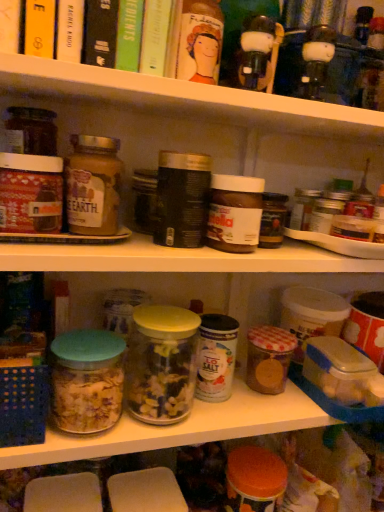
The width and height of the screenshot is (384, 512). Describe the element at coordinates (93, 185) in the screenshot. I see `matte glass jar at left, which ranks as the first cereal in left-to-right order` at that location.

What do you see at coordinates (100, 32) in the screenshot?
I see `hardcover book at upper left, acting as the 3th book starting from the right` at bounding box center [100, 32].

How much space does translucent glass jar at center, positioned as the 1th glass jar in right-to-left order, occupy horizontally?

translucent glass jar at center, positioned as the 1th glass jar in right-to-left order, is 10.41 centimeters in width.

The height and width of the screenshot is (512, 384). Describe the element at coordinates (269, 358) in the screenshot. I see `translucent glass jar of cereal at center, which appears as the second cereal when viewed from the front` at that location.

The height and width of the screenshot is (512, 384). Find the location of `hardcover book at upper left, the 1th book when ordered from left to right`. hardcover book at upper left, the 1th book when ordered from left to right is located at coordinates (70, 30).

Locate an element on the screen. The height and width of the screenshot is (512, 384). matte plastic jars at upper center, placed as the first shelf when sorted from top to bottom is located at coordinates (185, 97).

Could hardcover book at upper left, the fourth book from the right, be considered to be inside clear glass jars at center, arranged as the second shelf when viewed from the top?

No, hardcover book at upper left, the fourth book from the right, is not inside clear glass jars at center, arranged as the second shelf when viewed from the top.

Considering the positions of points (182, 423) and (63, 26), is point (182, 423) farther from camera compared to point (63, 26)?

Yes, point (182, 423) is behind point (63, 26).

Can you confirm if clear glass jars at center, placed as the first shelf when sorted from bottom to top, is thinner than hardcover book at upper left, the fourth book from the right?

No, clear glass jars at center, placed as the first shelf when sorted from bottom to top, is not thinner than hardcover book at upper left, the fourth book from the right.

Does clear glass jars at center, arranged as the second shelf when viewed from the top, touch hardcover book at upper left, the fourth book from the right?

No.

How different are the orientations of matte plastic jars at upper center, the 2th shelf ordered from the bottom, and green matte book at upper center, which appears as the third book when viewed from the left, in degrees?

A: 2.67 degrees separate the facing orientations of matte plastic jars at upper center, the 2th shelf ordered from the bottom, and green matte book at upper center, which appears as the third book when viewed from the left.

Between matte plastic jars at upper center, the 2th shelf ordered from the bottom, and green matte book at upper center, the second book when ordered from right to left, which one has less height?

With less height is matte plastic jars at upper center, the 2th shelf ordered from the bottom.

Starting from the matte plastic jars at upper center, placed as the first shelf when sorted from top to bottom, which book is the 3rd one behind? Please provide its 2D coordinates.

[(129, 35)]

Is green matte book at upper center, which is the 1th book from right to left, closer to camera compared to hardcover book at upper left, the fourth book from the right?

No, green matte book at upper center, which is the 1th book from right to left, is further to the viewer.

Is point (159, 50) behind point (79, 37)?

Yes.

From a real-world perspective, is green matte book at upper center, the second book when ordered from right to left, beneath green matte book at upper center, the 4th book viewed from the left?

Yes, from a real-world perspective, green matte book at upper center, the second book when ordered from right to left, is under green matte book at upper center, the 4th book viewed from the left.

Considering the sizes of objects green matte book at upper center, which appears as the third book when viewed from the left, and green matte book at upper center, the 4th book viewed from the left, in the image provided, who is smaller, green matte book at upper center, which appears as the third book when viewed from the left, or green matte book at upper center, the 4th book viewed from the left,?

Smaller between the two is green matte book at upper center, which appears as the third book when viewed from the left.

Consider the image. Is green matte book at upper center, the second book when ordered from right to left, aimed at green matte book at upper center, the 4th book viewed from the left?

No.

Considering the sizes of objects translucent glass jar filled with cereal at center, the first glass jar in the left-to-right sequence, and translucent glass jar of cereal at center, acting as the 1th cereal starting from the back, in the image provided, who is bigger, translucent glass jar filled with cereal at center, the first glass jar in the left-to-right sequence, or translucent glass jar of cereal at center, acting as the 1th cereal starting from the back,?

translucent glass jar filled with cereal at center, the first glass jar in the left-to-right sequence.

How far apart are translucent glass jar filled with cereal at center, the first glass jar in the left-to-right sequence, and translucent glass jar of cereal at center, acting as the 1th cereal starting from the back?

translucent glass jar filled with cereal at center, the first glass jar in the left-to-right sequence, and translucent glass jar of cereal at center, acting as the 1th cereal starting from the back, are 27.56 centimeters apart from each other.

Considering the positions of objects translucent glass jar filled with cereal at center, the 2th glass jar in the right-to-left sequence, and translucent glass jar of cereal at center, which ranks as the 1th cereal in bottom-to-top order, in the image provided, who is more to the left, translucent glass jar filled with cereal at center, the 2th glass jar in the right-to-left sequence, or translucent glass jar of cereal at center, which ranks as the 1th cereal in bottom-to-top order,?

translucent glass jar filled with cereal at center, the 2th glass jar in the right-to-left sequence, is more to the left.

Considering the relative positions of translucent glass jar filled with cereal at center, the first glass jar in the left-to-right sequence, and translucent glass jar of cereal at center, which appears as the second cereal when viewed from the front, in the image provided, is translucent glass jar filled with cereal at center, the first glass jar in the left-to-right sequence, behind translucent glass jar of cereal at center, which appears as the second cereal when viewed from the front,?

No, the depth of translucent glass jar filled with cereal at center, the first glass jar in the left-to-right sequence, is less than that of translucent glass jar of cereal at center, which appears as the second cereal when viewed from the front.

From a real-world perspective, which is physically above, translucent glass jar filled with cereal at center, the first glass jar in the left-to-right sequence, or green matte book at upper center, the second book when ordered from right to left?

From a 3D spatial view, green matte book at upper center, the second book when ordered from right to left, is above.

Would you say translucent glass jar filled with cereal at center, the 2th glass jar in the right-to-left sequence, contains green matte book at upper center, the second book when ordered from right to left?

No, green matte book at upper center, the second book when ordered from right to left, is located outside of translucent glass jar filled with cereal at center, the 2th glass jar in the right-to-left sequence.

In terms of width, does translucent glass jar filled with cereal at center, the first glass jar in the left-to-right sequence, look wider or thinner when compared to green matte book at upper center, which appears as the third book when viewed from the left?

Result: Clearly, translucent glass jar filled with cereal at center, the first glass jar in the left-to-right sequence, has less width compared to green matte book at upper center, which appears as the third book when viewed from the left.

Between point (63, 367) and point (136, 23), which one is positioned behind?

The point (63, 367) is behind.

Can you confirm if translucent glass jar at center, positioned as the 1th glass jar in right-to-left order, is shorter than hardcover book at upper left, the fourth book from the right?

Indeed, translucent glass jar at center, positioned as the 1th glass jar in right-to-left order, has a lesser height compared to hardcover book at upper left, the fourth book from the right.

Considering the relative sizes of translucent glass jar at center, which ranks as the second glass jar in left-to-right order, and hardcover book at upper left, the 1th book when ordered from left to right, in the image provided, is translucent glass jar at center, which ranks as the second glass jar in left-to-right order, smaller than hardcover book at upper left, the 1th book when ordered from left to right,?

Incorrect, translucent glass jar at center, which ranks as the second glass jar in left-to-right order, is not smaller in size than hardcover book at upper left, the 1th book when ordered from left to right.

From a real-world perspective, is translucent glass jar at center, which ranks as the second glass jar in left-to-right order, beneath hardcover book at upper left, the fourth book from the right?

Yes, from a real-world perspective, translucent glass jar at center, which ranks as the second glass jar in left-to-right order, is under hardcover book at upper left, the fourth book from the right.

From the image's perspective, is translucent glass jar at center, which ranks as the second glass jar in left-to-right order, over hardcover book at upper left, the fourth book from the right?

No, from the image's perspective, translucent glass jar at center, which ranks as the second glass jar in left-to-right order, is not over hardcover book at upper left, the fourth book from the right.

At what (x,y) coordinates should I click in order to perform the action: click on book that is the 3rd object located in front of the clear glass jars at center, arranged as the second shelf when viewed from the top. Please return your answer as a coordinate pair (x, y). The height and width of the screenshot is (512, 384). Looking at the image, I should click on (70, 30).

Where is `the 2nd book counting from the left side of the matte plastic jars at upper center, placed as the first shelf when sorted from top to bottom`? the 2nd book counting from the left side of the matte plastic jars at upper center, placed as the first shelf when sorted from top to bottom is located at coordinates point(129,35).

From the image, which object appears to be farther from translucent glass jar at center, positioned as the 1th glass jar in right-to-left order, clear glass jars at center, placed as the first shelf when sorted from bottom to top, or green matte book at upper center, the 4th book viewed from the left?

Based on the image, green matte book at upper center, the 4th book viewed from the left, appears to be further to translucent glass jar at center, positioned as the 1th glass jar in right-to-left order.

When comparing their distances from translucent glass jar filled with cereal at center, the 2th glass jar in the right-to-left sequence, does green matte book at upper center, the second book when ordered from right to left, or hardcover book at upper left, the fourth book from the right, seem further?

green matte book at upper center, the second book when ordered from right to left, is positioned further to the anchor translucent glass jar filled with cereal at center, the 2th glass jar in the right-to-left sequence.

Which object lies further to the anchor point clear glass jars at center, placed as the first shelf when sorted from bottom to top, translucent glass jar at center, which ranks as the second glass jar in left-to-right order, or translucent glass jar of cereal at center, the 2th cereal when ordered from top to bottom?

Based on the image, translucent glass jar of cereal at center, the 2th cereal when ordered from top to bottom, appears to be further to clear glass jars at center, placed as the first shelf when sorted from bottom to top.

From the picture: Based on their spatial positions, is clear glass jars at center, placed as the first shelf when sorted from bottom to top, or hardcover book at upper left, the fourth book from the right, further from translucent glass jar at center, which ranks as the second glass jar in left-to-right order?

Among the two, hardcover book at upper left, the fourth book from the right, is located further to translucent glass jar at center, which ranks as the second glass jar in left-to-right order.

From the image, which object appears to be nearer to hardcover book at upper left, positioned as the second book in left-to-right order, translucent glass jar of cereal at center, which ranks as the 1th cereal in bottom-to-top order, or matte glass jar at left, acting as the second cereal starting from the back?

matte glass jar at left, acting as the second cereal starting from the back, lies closer to hardcover book at upper left, positioned as the second book in left-to-right order, than the other object.

Based on their spatial positions, is matte plastic jars at upper center, the 2th shelf ordered from the bottom, or green matte book at upper center, which appears as the third book when viewed from the left, further from green matte book at upper center, which is the 1th book from right to left?

matte plastic jars at upper center, the 2th shelf ordered from the bottom, is further to green matte book at upper center, which is the 1th book from right to left.

From the image, which object appears to be farther from green matte book at upper center, the second book when ordered from right to left, green matte book at upper center, the 4th book viewed from the left, or translucent glass jar filled with cereal at center, the 2th glass jar in the right-to-left sequence?

Among the two, translucent glass jar filled with cereal at center, the 2th glass jar in the right-to-left sequence, is located further to green matte book at upper center, the second book when ordered from right to left.

From the image, which object appears to be nearer to translucent glass jar of cereal at center, which appears as the second cereal when viewed from the front, clear glass jars at center, placed as the first shelf when sorted from bottom to top, or matte glass jar at left, acting as the 2th cereal starting from the bottom?

The object closer to translucent glass jar of cereal at center, which appears as the second cereal when viewed from the front, is clear glass jars at center, placed as the first shelf when sorted from bottom to top.

Image resolution: width=384 pixels, height=512 pixels. In order to click on book between hardcover book at upper left, the fourth book from the right, and translucent glass jar at center, which ranks as the second glass jar in left-to-right order, in the vertical direction in this screenshot , I will do `click(129, 35)`.

Identify the location of shelf between hardcover book at upper left, the 1th book when ordered from left to right, and translucent glass jar of cereal at center, acting as the 1th cereal starting from the back, in the up-down direction. This screenshot has width=384, height=512. (185, 97).

At what (x,y) coordinates should I click in order to perform the action: click on shelf between green matte book at upper center, the second book when ordered from right to left, and translucent glass jar at center, positioned as the 1th glass jar in right-to-left order, in the vertical direction. Please return your answer as a coordinate pair (x, y). Looking at the image, I should click on (185, 97).

Find the location of a particular element. glass jar that lies between green matte book at upper center, the second book when ordered from right to left, and translucent glass jar filled with cereal at center, the 2th glass jar in the right-to-left sequence, from top to bottom is located at coordinates (161, 364).